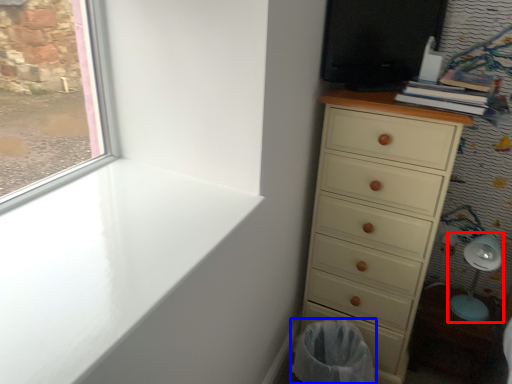
Question: Which object is further to the camera taking this photo, swivel chair (highlighted by a red box) or laundry basket (highlighted by a blue box)?

Choices:
 (A) swivel chair
 (B) laundry basket

Answer: (A)